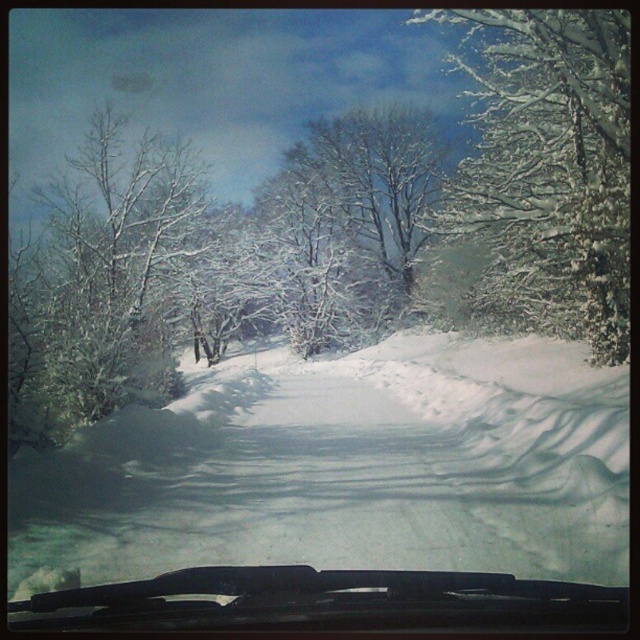
You are driving in a snowy area and want to know if the white frosty tree at center is visible through the transparent glass windshield at center. Can you see it?

The transparent glass windshield at center is closer to the viewer than the white frosty tree at center, so yes, you can see the white frosty tree at center through the transparent glass windshield at center because it is behind the windshield.

In the scene shown: You are driving a car with a 1.2 meter wide dashboard. You notice the transparent glass windshield at center and the white frosty tree at center outside. Can the tree fit entirely within your view through the windshield without moving the car?

The transparent glass windshield at center has a lesser width compared to white frosty tree at center, so the tree cannot fit entirely within the view through the windshield without moving the car.